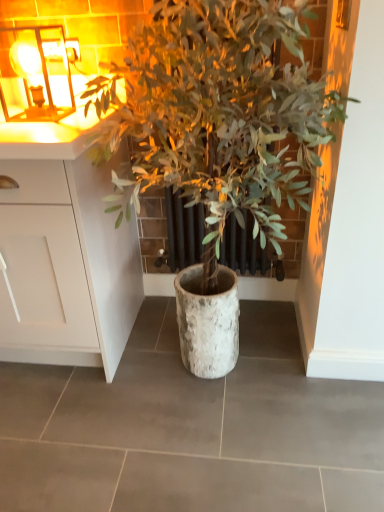
Describe the element at coordinates (36, 73) in the screenshot. I see `metallic glass at upper left` at that location.

You are a GUI agent. You are given a task and a screenshot of the screen. Output one action in this format:
    pyautogui.click(x=<x>, y=<y>)
    Task: Click on the white matte cabinet at left
    Image resolution: width=384 pixels, height=512 pixels.
    Given the screenshot: What is the action you would take?
    pyautogui.click(x=66, y=266)

Locate an element on the screen. The width and height of the screenshot is (384, 512). metallic glass at upper left is located at coordinates (36, 73).

Can you confirm if white matte cabinet at left is positioned to the right of green leafy plant at center?

No.

From the image's perspective, is white matte cabinet at left located above green leafy plant at center?

No, from the image's perspective, white matte cabinet at left is not on top of green leafy plant at center.

Which object is further away from the camera taking this photo, white matte cabinet at left or green leafy plant at center?

white matte cabinet at left is more distant.

From a real-world perspective, which object stands above the other?

green leafy plant at center.

Is white matte cabinet at left located outside metallic glass at upper left?

Indeed, white matte cabinet at left is completely outside metallic glass at upper left.

What's the angular difference between white matte cabinet at left and metallic glass at upper left's facing directions?

The facing directions of white matte cabinet at left and metallic glass at upper left are 0.286 degrees apart.

How far apart are white matte cabinet at left and metallic glass at upper left?

20.28 inches.

Consider the image. Is white matte cabinet at left closer to camera compared to metallic glass at upper left?

Yes, it is.

Locate an element on the screen. light fixture above the green leafy plant at center (from a real-world perspective) is located at coordinates (36, 73).

Who is bigger, green leafy plant at center or metallic glass at upper left?

Bigger between the two is green leafy plant at center.

From the image's perspective, is green leafy plant at center located above metallic glass at upper left?

No.

Visually, is green leafy plant at center positioned to the left or to the right of metallic glass at upper left?

Clearly, green leafy plant at center is on the right of metallic glass at upper left in the image.

From a real-world perspective, between metallic glass at upper left and green leafy plant at center, who is vertically lower?

green leafy plant at center is physically lower.

Considering the sizes of objects metallic glass at upper left and green leafy plant at center in the image provided, who is wider, metallic glass at upper left or green leafy plant at center?

green leafy plant at center.

Is point (56, 62) closer or farther from the camera than point (197, 183)?

Point (56, 62) appears to be farther away from the viewer than point (197, 183).

Which of these two, metallic glass at upper left or green leafy plant at center, stands shorter?

Standing shorter between the two is metallic glass at upper left.

Is metallic glass at upper left placed right next to white matte cabinet at left?

No, metallic glass at upper left is not in contact with white matte cabinet at left.

Is metallic glass at upper left turned away from white matte cabinet at left?

No, metallic glass at upper left is not facing away from white matte cabinet at left.

From a real-world perspective, between metallic glass at upper left and white matte cabinet at left, who is vertically lower?

From a 3D spatial view, white matte cabinet at left is below.

Is metallic glass at upper left positioned beyond the bounds of white matte cabinet at left?

Yes, metallic glass at upper left is not within white matte cabinet at left.

From the image's perspective, between green leafy plant at center and white matte cabinet at left, which one is located above?

green leafy plant at center is shown above in the image.

Who is shorter, green leafy plant at center or white matte cabinet at left?

Standing shorter between the two is white matte cabinet at left.

Is green leafy plant at center with white matte cabinet at left?

green leafy plant at center and white matte cabinet at left are not in contact.

What's the angular difference between green leafy plant at center and white matte cabinet at left's facing directions?

3.08 degrees.

Where is `cabinetry below the green leafy plant at center (from the image's perspective)`? The height and width of the screenshot is (512, 384). cabinetry below the green leafy plant at center (from the image's perspective) is located at coordinates (66, 266).

Find the location of a particular element. The width and height of the screenshot is (384, 512). cabinetry that appears in front of the metallic glass at upper left is located at coordinates (66, 266).

Based on their spatial positions, is white matte cabinet at left or green leafy plant at center closer to metallic glass at upper left?

white matte cabinet at left is positioned closer to the anchor metallic glass at upper left.

When comparing their distances from green leafy plant at center, does metallic glass at upper left or white matte cabinet at left seem closer?

white matte cabinet at left is positioned closer to the anchor green leafy plant at center.

Based on their spatial positions, is white matte cabinet at left or metallic glass at upper left closer to green leafy plant at center?

Based on the image, white matte cabinet at left appears to be nearer to green leafy plant at center.

When comparing their distances from white matte cabinet at left, does metallic glass at upper left or green leafy plant at center seem further?

metallic glass at upper left is positioned further to the anchor white matte cabinet at left.

From the image, which object appears to be farther from metallic glass at upper left, green leafy plant at center or white matte cabinet at left?

green leafy plant at center.

Estimate the real-world distances between objects in this image. Which object is further from white matte cabinet at left, green leafy plant at center or metallic glass at upper left?

metallic glass at upper left.

You are a GUI agent. You are given a task and a screenshot of the screen. Output one action in this format:
    pyautogui.click(x=<x>, y=<y>)
    Task: Click on the light fixture between white matte cabinet at left and green leafy plant at center
    
    Given the screenshot: What is the action you would take?
    pyautogui.click(x=36, y=73)